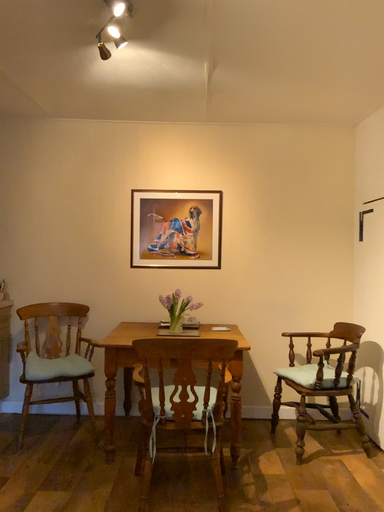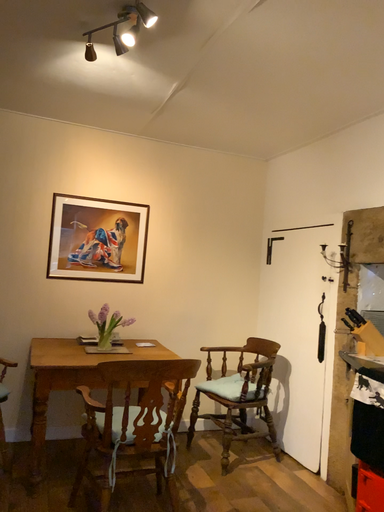
Question: Which way did the camera rotate in the video?

Choices:
 (A) rotated left
 (B) rotated right

Answer: (B)